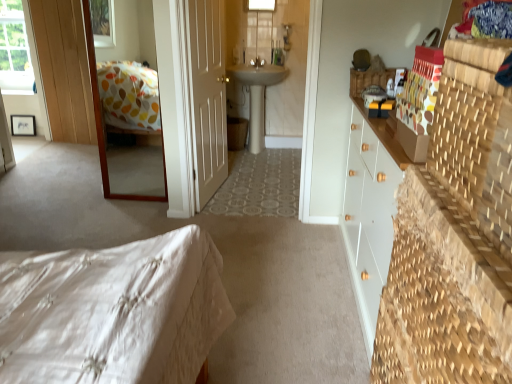
Question: From a real-world perspective, is wooden-framed mirror at upper left positioned above or below white matte door at center?

Choices:
 (A) below
 (B) above

Answer: (A)

Question: Considering the positions of point (150, 158) and point (202, 69), is point (150, 158) closer or farther from the camera than point (202, 69)?

Choices:
 (A) farther
 (B) closer

Answer: (A)

Question: Based on their relative distances, which object is nearer to the wooden-framed mirror at upper left?

Choices:
 (A) white ceramic sink at center
 (B) transparent glass window at upper left, which is the 2th window from front to back
 (C) white matte door at center
 (D) transparent glass window at upper center, which is the 1th window in front-to-back order
 (E) white quilted bed at lower left

Answer: (C)

Question: Which of these objects is positioned closest to the white ceramic sink at center?

Choices:
 (A) wooden-framed mirror at upper left
 (B) white quilted bed at lower left
 (C) transparent glass window at upper left, which is the 2th window from front to back
 (D) transparent glass window at upper center, which ranks as the second window in back-to-front order
 (E) white matte door at center

Answer: (D)